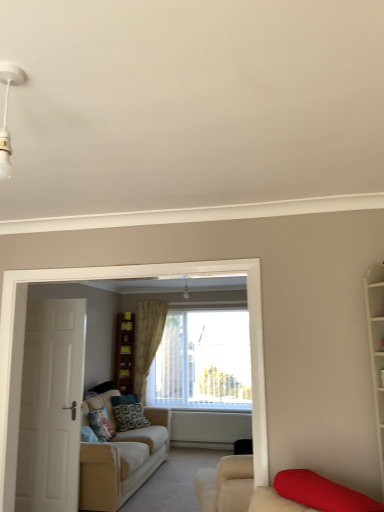
Question: Is white wooden bookshelf at right taller or shorter than beige textured curtain at center?

Choices:
 (A) tall
 (B) short

Answer: (B)

Question: From the image's perspective, relative to beige textured curtain at center, is white wooden bookshelf at right above or below?

Choices:
 (A) below
 (B) above

Answer: (B)

Question: Considering the real-world distances, which object is farthest from the white wooden door at left?

Choices:
 (A) velvet red cushion at lower right
 (B) beige fabric couch at left
 (C) white wooden bookshelf at right
 (D) white matte radiator at center
 (E) wooden bookshelf at center, placed as the first shelf when sorted from bottom to top

Answer: (C)

Question: Which object is positioned closest to the white plastic light fixture at upper left?

Choices:
 (A) brown wooden bookshelf at center
 (B) beige fabric couch at left
 (C) white wooden bookshelf at right
 (D) patterned fabric pillow at center, the second pillow from the back
 (E) patterned fabric pillow at center, the 2th pillow in the front-to-back sequence

Answer: (C)